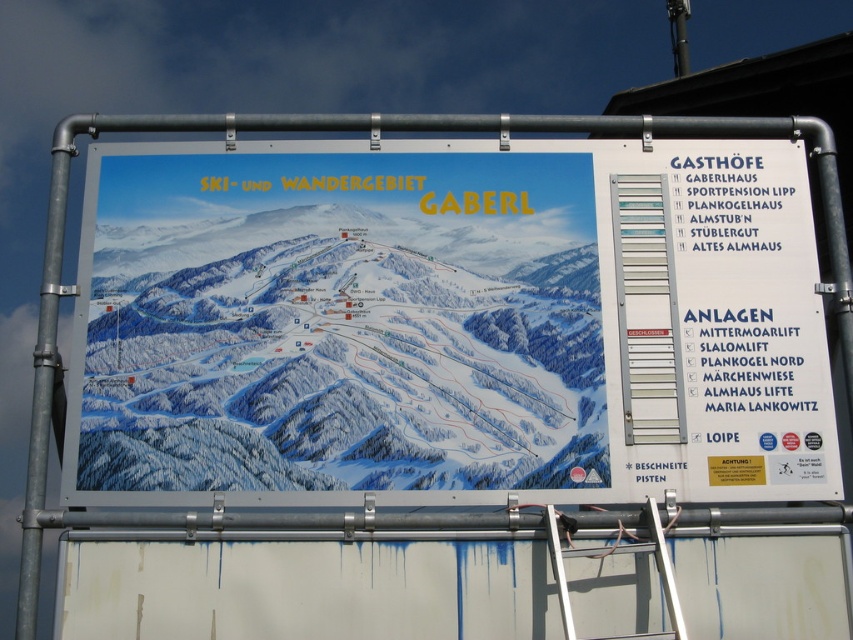
You are a maintenance worker who needs to reach the top of the signboard to adjust the silver metallic ladder at right and the white plastic ladder at lower center. Which ladder is closer to the top of the signboard?

The silver metallic ladder at right is closer to the top of the signboard than the white plastic ladder at lower center because it is positioned higher on the signboard.

You are standing in front of the signboard at the ski resort. There is a silver metallic ladder at right. Can you reach the top of the ladder without climbing it?

The silver metallic ladder at right is 5.19 meters away from you, so you cannot reach the top of the silver metallic ladder at right without climbing it.